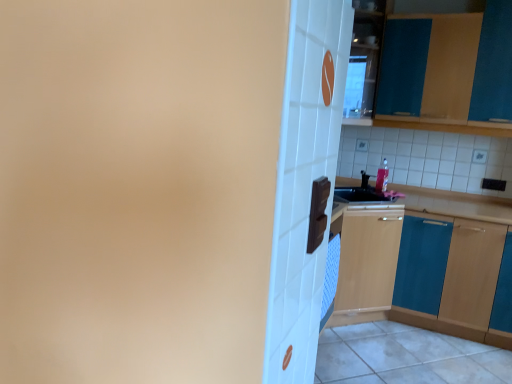
Question: Considering the relative positions of teal wood cabinet at upper right, positioned as the first cabinetry in top-to-bottom order, and white glossy tile at lower right in the image provided, is teal wood cabinet at upper right, positioned as the first cabinetry in top-to-bottom order, to the right of white glossy tile at lower right from the viewer's perspective?

Choices:
 (A) yes
 (B) no

Answer: (A)

Question: Can you confirm if teal wood cabinet at upper right, the 2th cabinetry ordered from the bottom, is smaller than white glossy tile at lower right?

Choices:
 (A) yes
 (B) no

Answer: (B)

Question: Is white glossy tile at lower right at the back of teal wood cabinet at upper right, positioned as the first cabinetry in top-to-bottom order?

Choices:
 (A) no
 (B) yes

Answer: (A)

Question: Considering the relative sizes of teal wood cabinet at upper right, positioned as the first cabinetry in top-to-bottom order, and white glossy tile at lower right in the image provided, is teal wood cabinet at upper right, positioned as the first cabinetry in top-to-bottom order, bigger than white glossy tile at lower right?

Choices:
 (A) no
 (B) yes

Answer: (B)

Question: Considering the positions of point (369, 327) and point (419, 233), is point (369, 327) closer or farther from the camera than point (419, 233)?

Choices:
 (A) closer
 (B) farther

Answer: (B)

Question: In the image, is white glossy tile at lower right on the left side or the right side of teal wood cabinet at right, placed as the first cabinetry when sorted from bottom to top?

Choices:
 (A) left
 (B) right

Answer: (A)

Question: Is white glossy tile at lower right taller or shorter than teal wood cabinet at right, placed as the first cabinetry when sorted from bottom to top?

Choices:
 (A) short
 (B) tall

Answer: (A)

Question: Looking at the image, does white glossy tile at lower right seem bigger or smaller compared to teal wood cabinet at right, placed as the first cabinetry when sorted from bottom to top?

Choices:
 (A) small
 (B) big

Answer: (A)

Question: From a real-world perspective, is white glossy tile at lower right positioned above or below teal wood cabinet at upper right, positioned as the first cabinetry in top-to-bottom order?

Choices:
 (A) above
 (B) below

Answer: (B)

Question: Is white glossy tile at lower right situated inside teal wood cabinet at upper right, the 2th cabinetry ordered from the bottom, or outside?

Choices:
 (A) inside
 (B) outside

Answer: (B)

Question: Would you say white glossy tile at lower right is to the left or to the right of teal wood cabinet at upper right, positioned as the first cabinetry in top-to-bottom order, in the picture?

Choices:
 (A) left
 (B) right

Answer: (A)

Question: Based on their sizes in the image, would you say white glossy tile at lower right is bigger or smaller than teal wood cabinet at upper right, positioned as the first cabinetry in top-to-bottom order?

Choices:
 (A) small
 (B) big

Answer: (A)

Question: Is teal wood cabinet at right, placed as the first cabinetry when sorted from bottom to top, situated inside teal wood cabinet at upper right, positioned as the first cabinetry in top-to-bottom order, or outside?

Choices:
 (A) inside
 (B) outside

Answer: (B)

Question: Does point (420, 304) appear closer or farther from the camera than point (415, 94)?

Choices:
 (A) closer
 (B) farther

Answer: (A)